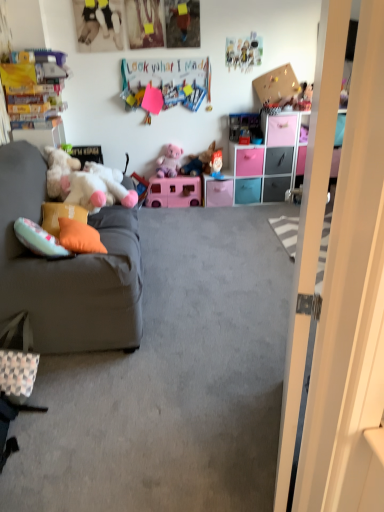
How much space does black matte drawer at center, which is the second drawer in right-to-left order, occupy vertically?

It is 27.74 centimeters.

The image size is (384, 512). What do you see at coordinates (279, 160) in the screenshot?
I see `black matte drawer at center, which is the 5th drawer in left-to-right order` at bounding box center [279, 160].

What do you see at coordinates (219, 193) in the screenshot? I see `pink plastic drawer at center, marked as the 1th drawer in a left-to-right arrangement` at bounding box center [219, 193].

In order to click on fluffy plush toy at center, the 3th toy from the top in this screenshot , I will do `click(199, 162)`.

Describe the element at coordinates (199, 162) in the screenshot. I see `fluffy plush toy at center, the third toy positioned from the bottom` at that location.

What is the approximate height of pink plastic drawer at center, which appears as the 5th drawer when viewed from the right?

pink plastic drawer at center, which appears as the 5th drawer when viewed from the right, is 10.88 inches tall.

What do you see at coordinates (275, 188) in the screenshot? I see `matte black drawer at center, which is counted as the 6th drawer, starting from the left` at bounding box center [275, 188].

Identify the location of orange fabric pillow at left, the 2th pillow positioned from the front. The image size is (384, 512). (60, 215).

Locate an element on the screen. black matte drawer at center, which is the 5th drawer in left-to-right order is located at coordinates pos(279,160).

Is blue fabric doll at center, the third toy when ordered from right to left, positioned behind teal plastic drawer at center, which is the third drawer from left to right?

No, blue fabric doll at center, the third toy when ordered from right to left, is closer to the camera.

Is blue fabric doll at center, positioned as the 2th toy in bottom-to-top order, positioned beyond the bounds of teal plastic drawer at center, which is the third drawer from left to right?

Yes, blue fabric doll at center, positioned as the 2th toy in bottom-to-top order, is outside of teal plastic drawer at center, which is the third drawer from left to right.

How different are the orientations of blue fabric doll at center, positioned as the 2th toy in bottom-to-top order, and teal plastic drawer at center, which is the third drawer from left to right, in degrees?

Result: They differ by 0.53 degrees in their facing directions.

From the picture: Is orange fabric pillow at left, the second pillow when ordered from back to front, surrounding plush pink teddy bear at upper right, the 2th toy viewed from the top?

No, orange fabric pillow at left, the second pillow when ordered from back to front, does not contain plush pink teddy bear at upper right, the 2th toy viewed from the top.

From a real-world perspective, which object stands above the other?

From a 3D spatial view, plush pink teddy bear at upper right, the 2th toy viewed from the top, is above.

Is point (80, 223) behind point (304, 109)?

No, (80, 223) is closer to viewer.

Which of these two, orange fabric pillow at left, the second pillow when ordered from back to front, or plush pink teddy bear at upper right, the first toy from the right, is smaller?

plush pink teddy bear at upper right, the first toy from the right.

Consider the image. How different are the orientations of teal plastic drawer at center, which is the third drawer from left to right, and blue fabric doll at center, positioned as the fourth toy in top-to-bottom order, in degrees?

teal plastic drawer at center, which is the third drawer from left to right, and blue fabric doll at center, positioned as the fourth toy in top-to-bottom order, are facing 0.53 degrees away from each other.

Which is behind, point (245, 182) or point (214, 166)?

Point (214, 166)

Based on the photo, between teal plastic drawer at center, which is the third drawer from left to right, and blue fabric doll at center, positioned as the 2th toy in bottom-to-top order, which one appears on the left side from the viewer's perspective?

blue fabric doll at center, positioned as the 2th toy in bottom-to-top order, is more to the left.

Considering the relative sizes of teal plastic drawer at center, the 4th drawer when ordered from right to left, and blue fabric doll at center, positioned as the 2th toy in bottom-to-top order, in the image provided, is teal plastic drawer at center, the 4th drawer when ordered from right to left, wider than blue fabric doll at center, positioned as the 2th toy in bottom-to-top order,?

Yes, teal plastic drawer at center, the 4th drawer when ordered from right to left, is wider than blue fabric doll at center, positioned as the 2th toy in bottom-to-top order.

Is matte black drawer at center, which is counted as the 6th drawer, starting from the left, bigger or smaller than orange fabric pillow at left, the second pillow when ordered from back to front?

Clearly, matte black drawer at center, which is counted as the 6th drawer, starting from the left, is larger in size than orange fabric pillow at left, the second pillow when ordered from back to front.

From a real-world perspective, count 2nd pillows upward from the matte black drawer at center, which is counted as the 6th drawer, starting from the left, and point to it. Please provide its 2D coordinates.

[(79, 237)]

From the image's perspective, which is below, matte black drawer at center, which is counted as the 6th drawer, starting from the left, or orange fabric pillow at left, the 1th pillow positioned from the front?

→ orange fabric pillow at left, the 1th pillow positioned from the front, appears lower in the image.

Which is behind, point (284, 182) or point (61, 224)?

The point (284, 182) is behind.

Looking at this image, is blue fabric doll at center, which ranks as the third toy in left-to-right order, next to black matte drawer at center, which is the second drawer in right-to-left order, and touching it?

No, blue fabric doll at center, which ranks as the third toy in left-to-right order, is not next to black matte drawer at center, which is the second drawer in right-to-left order.

Is blue fabric doll at center, the third toy when ordered from right to left, further to camera compared to black matte drawer at center, which is the 5th drawer in left-to-right order?

No, it is in front of black matte drawer at center, which is the 5th drawer in left-to-right order.

Is blue fabric doll at center, positioned as the fourth toy in top-to-bottom order, bigger or smaller than black matte drawer at center, which is the second drawer in right-to-left order?

In the image, blue fabric doll at center, positioned as the fourth toy in top-to-bottom order, appears to be smaller than black matte drawer at center, which is the second drawer in right-to-left order.

Is multicolored paper at upper center next to pink plastic camper at center, acting as the first toy starting from the left, and touching it?

No, multicolored paper at upper center is not in contact with pink plastic camper at center, acting as the first toy starting from the left.

Is multicolored paper at upper center bigger than pink plastic camper at center, acting as the first toy starting from the left?

No.

How much distance is there between multicolored paper at upper center and pink plastic camper at center, the fifth toy viewed from the right?

multicolored paper at upper center and pink plastic camper at center, the fifth toy viewed from the right, are 87.57 centimeters apart from each other.

Is multicolored paper at upper center facing away from pink plastic camper at center, positioned as the 5th toy in top-to-bottom order?

No.

Does plush pink teddy bear at upper right, placed as the 5th toy when sorted from left to right, appear on the left side of black matte drawer at center, which is the 5th drawer in left-to-right order?

No.

Is plush pink teddy bear at upper right, the first toy from the right, turned away from black matte drawer at center, which is the second drawer in right-to-left order?

No, plush pink teddy bear at upper right, the first toy from the right, is not facing the opposite direction of black matte drawer at center, which is the second drawer in right-to-left order.

Which of these two, plush pink teddy bear at upper right, the fourth toy in the bottom-to-top sequence, or black matte drawer at center, which is the 5th drawer in left-to-right order, is smaller?

plush pink teddy bear at upper right, the fourth toy in the bottom-to-top sequence.

Identify the location of the 2nd toy counting from the left side of the teal plastic drawer at center, which is the third drawer from left to right. (216, 164).

Find the location of `the 2nd pillow below the plush pink teddy bear at upper right, the 2th toy viewed from the top (from the image's perspective)`. the 2nd pillow below the plush pink teddy bear at upper right, the 2th toy viewed from the top (from the image's perspective) is located at coordinates (79, 237).

Which object lies further to the anchor point white glossy door at right, pink plastic camper at center, the fifth toy viewed from the right, or velvet gray couch at left?

Among the two, pink plastic camper at center, the fifth toy viewed from the right, is located further to white glossy door at right.

Which object lies further to the anchor point white glossy door at right, pink plastic drawer at center, acting as the 6th drawer starting from the right, or teal plastic drawer at center, the 4th drawer when ordered from right to left?

teal plastic drawer at center, the 4th drawer when ordered from right to left.

When comparing their distances from pink plastic camper at center, acting as the first toy starting from the left, does plush pink teddy bear at upper right, the fourth toy in the bottom-to-top sequence, or plush toy at upper center, the fifth toy ordered from the bottom, seem closer?

plush toy at upper center, the fifth toy ordered from the bottom.

Which object lies further to the anchor point white plush toy at left, multicolored paper at upper center or black matte drawer at center, which is the 5th drawer in left-to-right order?

Based on the image, black matte drawer at center, which is the 5th drawer in left-to-right order, appears to be further to white plush toy at left.

From the image, which object appears to be nearer to white glossy door at right, corkboard at upper right or orange fabric pillow at left, the 1th pillow positioned from the front?

Among the two, orange fabric pillow at left, the 1th pillow positioned from the front, is located nearer to white glossy door at right.

From the image, which object appears to be farther from pink plastic camper at center, the fifth toy viewed from the right, velvet gray couch at left or fluffy plush toy at center, the second toy positioned from the left?

velvet gray couch at left is further to pink plastic camper at center, the fifth toy viewed from the right.

From the image, which object appears to be farther from blue fabric doll at center, the third toy when ordered from right to left, velvet gray couch at left or white glossy door at right?

Based on the image, white glossy door at right appears to be further to blue fabric doll at center, the third toy when ordered from right to left.

Looking at the image, which one is located further to pink plastic camper at center, acting as the first toy starting from the left, teal plastic drawer at center, which is the third drawer from left to right, or velvet gray couch at left?

velvet gray couch at left is further to pink plastic camper at center, acting as the first toy starting from the left.

Where is `studio couch located between velvet gray couch at left and corkboard at upper right in the depth direction`? studio couch located between velvet gray couch at left and corkboard at upper right in the depth direction is located at coordinates (67, 269).

This screenshot has height=512, width=384. I want to click on cabinetry between white plush toy at left and pink plastic drawer at center, the third drawer from the right, so click(x=270, y=159).

Identify the location of cabinetry between white plush toy at left and pink plastic drawer at center, marked as the 1th drawer in a left-to-right arrangement, from front to back. (270, 159).

This screenshot has height=512, width=384. Identify the location of cabinetry between pink plastic drawer at center, placed as the 4th drawer when sorted from left to right, and teal plastic drawer at center, which is the third drawer from left to right, in the vertical direction. (270, 159).